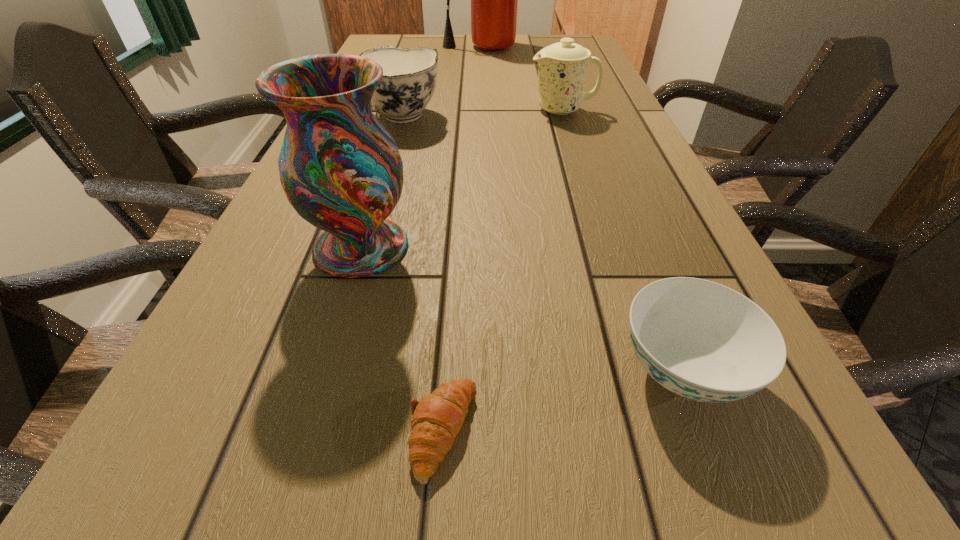
Find the location of `free spot that satisfies the following two spatial constraints: 1. on the front side of the shortest chinaware; 2. on the left side of the second tallest chinaware`. free spot that satisfies the following two spatial constraints: 1. on the front side of the shortest chinaware; 2. on the left side of the second tallest chinaware is located at coordinates (325, 371).

This screenshot has width=960, height=540. Find the location of `free location that satisfies the following two spatial constraints: 1. on the spout of the second shortest object; 2. on the left side of the third tallest object`. free location that satisfies the following two spatial constraints: 1. on the spout of the second shortest object; 2. on the left side of the third tallest object is located at coordinates (645, 371).

At what (x,y) coordinates should I click in order to perform the action: click on blank space that satisfies the following two spatial constraints: 1. on the instruction side of the tallest object; 2. on the right side of the second shortest object. Please return your answer as a coordinate pair (x, y). This screenshot has width=960, height=540. Looking at the image, I should click on (486, 371).